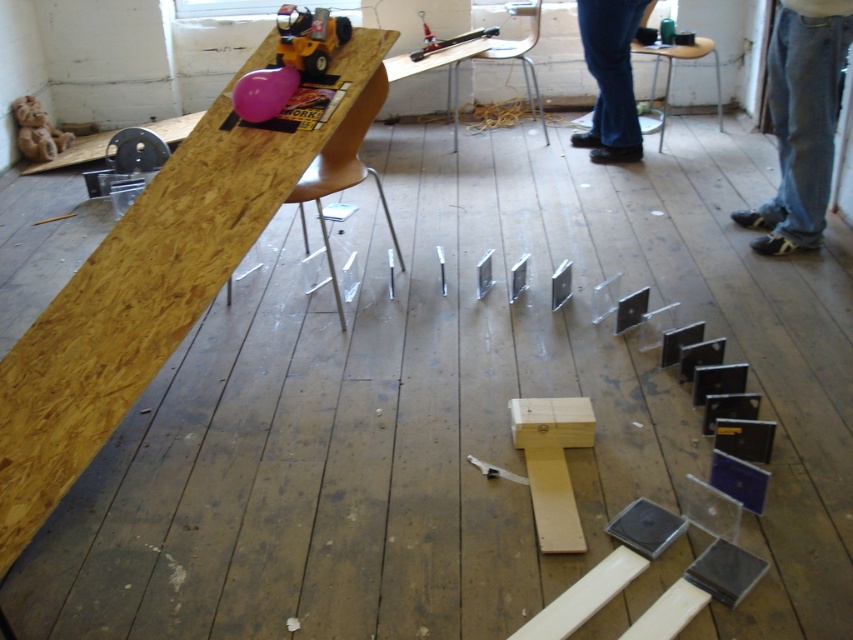
The width and height of the screenshot is (853, 640). What do you see at coordinates (610, 77) in the screenshot? I see `jeans at lower right` at bounding box center [610, 77].

The width and height of the screenshot is (853, 640). In order to click on jeans at lower right in this screenshot , I will do `click(610, 77)`.

Identify the location of jeans at lower right. The image size is (853, 640). (610, 77).

The width and height of the screenshot is (853, 640). In order to click on jeans at lower right in this screenshot , I will do `click(610, 77)`.

Can you confirm if wooden plank at upper left is wider than jeans at lower right?

Indeed, wooden plank at upper left has a greater width compared to jeans at lower right.

Find the location of a particular element. This screenshot has width=853, height=640. wooden plank at upper left is located at coordinates (144, 296).

Looking at this image, can you confirm if blue jeans at right is bigger than jeans at lower right?

Indeed, blue jeans at right has a larger size compared to jeans at lower right.

Can you confirm if blue jeans at right is taller than jeans at lower right?

Correct, blue jeans at right is much taller as jeans at lower right.

This screenshot has width=853, height=640. Describe the element at coordinates (801, 120) in the screenshot. I see `blue jeans at right` at that location.

Where is `blue jeans at right`? This screenshot has width=853, height=640. blue jeans at right is located at coordinates (801, 120).